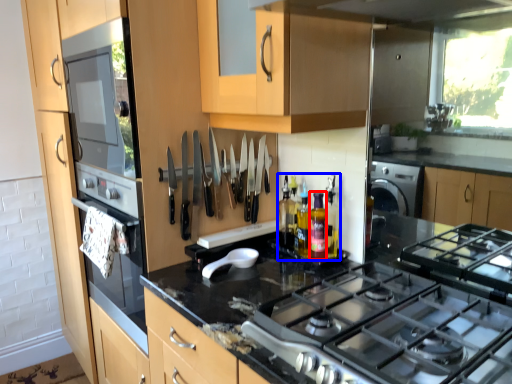
Question: Which object is closer to the camera taking this photo, bottle (highlighted by a red box) or bottle (highlighted by a blue box)?

Choices:
 (A) bottle
 (B) bottle

Answer: (A)